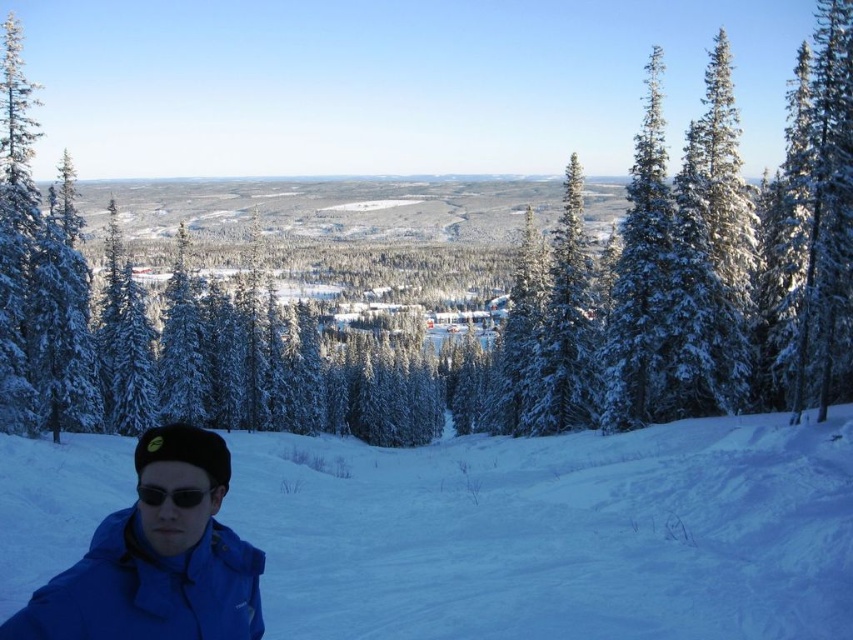
Question: Which point is closer to the camera?

Choices:
 (A) (827, 3)
 (B) (582, 284)
 (C) (213, 492)

Answer: (C)

Question: Is blue matte jacket at lower left to the left of black matte sunglasses at lower left from the viewer's perspective?

Choices:
 (A) no
 (B) yes

Answer: (B)

Question: Which object appears closest to the camera in this image?

Choices:
 (A) black matte sunglasses at lower left
 (B) blue snow at lower left

Answer: (A)

Question: Is blue snow at lower left above blue matte jacket at lower left?

Choices:
 (A) no
 (B) yes

Answer: (A)

Question: Estimate the real-world distances between objects in this image. Which object is closer to the black matte sunglasses at lower left?

Choices:
 (A) blue snow at lower left
 (B) blue matte jacket at lower left

Answer: (B)

Question: Is snow-covered evergreen at right above black matte sunglasses at lower left?

Choices:
 (A) yes
 (B) no

Answer: (A)